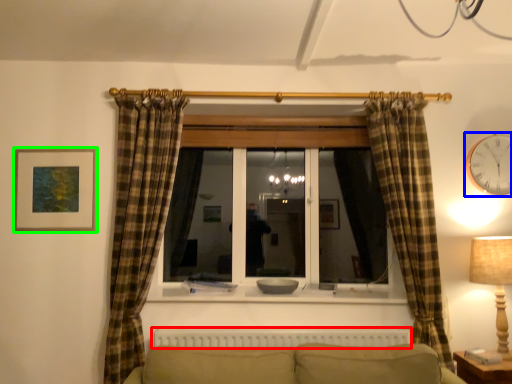
Question: Which object is positioned closest to radiator (highlighted by a red box)? Select from clock (highlighted by a blue box) and picture frame (highlighted by a green box).

Choices:
 (A) clock
 (B) picture frame

Answer: (B)